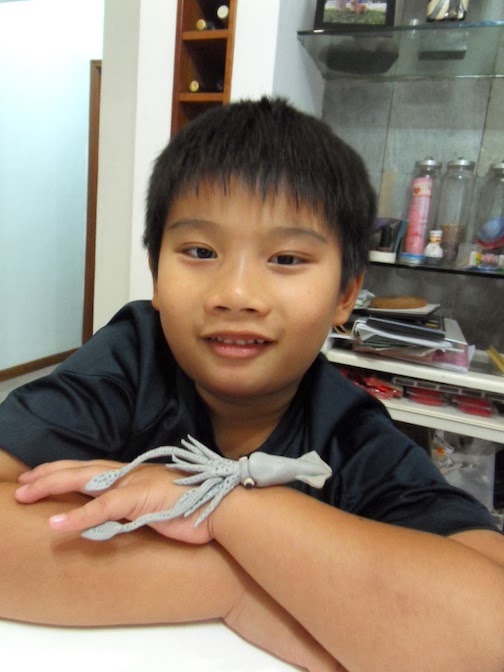
This screenshot has width=504, height=672. Identify the location of brown wooden shelves, upper left side. (212, 60), (212, 84).